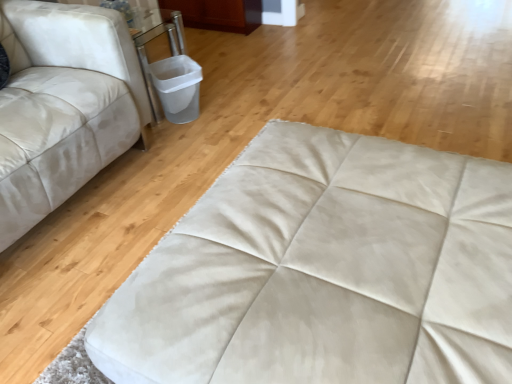
Question: Does white leather studio couch at left come in front of beige suede ottoman at center?

Choices:
 (A) yes
 (B) no

Answer: (B)

Question: Can you confirm if white leather studio couch at left is bigger than beige suede ottoman at center?

Choices:
 (A) no
 (B) yes

Answer: (B)

Question: Considering the relative sizes of white leather studio couch at left and beige suede ottoman at center in the image provided, is white leather studio couch at left taller than beige suede ottoman at center?

Choices:
 (A) no
 (B) yes

Answer: (B)

Question: Is white leather studio couch at left placed right next to beige suede ottoman at center?

Choices:
 (A) yes
 (B) no

Answer: (B)

Question: Would you say white leather studio couch at left contains beige suede ottoman at center?

Choices:
 (A) yes
 (B) no

Answer: (B)

Question: Considering the relative sizes of white leather studio couch at left and beige suede ottoman at center in the image provided, is white leather studio couch at left thinner than beige suede ottoman at center?

Choices:
 (A) no
 (B) yes

Answer: (B)

Question: Is beige suede ottoman at center taller than white leather studio couch at left?

Choices:
 (A) yes
 (B) no

Answer: (B)

Question: Considering the relative sizes of beige suede ottoman at center and white leather studio couch at left in the image provided, is beige suede ottoman at center smaller than white leather studio couch at left?

Choices:
 (A) no
 (B) yes

Answer: (B)

Question: Considering the relative positions of beige suede ottoman at center and white leather studio couch at left in the image provided, is beige suede ottoman at center behind white leather studio couch at left?

Choices:
 (A) yes
 (B) no

Answer: (B)

Question: From a real-world perspective, is beige suede ottoman at center under white leather studio couch at left?

Choices:
 (A) no
 (B) yes

Answer: (B)

Question: Is beige suede ottoman at center aimed at white leather studio couch at left?

Choices:
 (A) yes
 (B) no

Answer: (B)

Question: Is beige suede ottoman at center located outside white leather studio couch at left?

Choices:
 (A) yes
 (B) no

Answer: (A)

Question: Considering the positions of beige suede ottoman at center and white leather studio couch at left in the image, is beige suede ottoman at center bigger or smaller than white leather studio couch at left?

Choices:
 (A) small
 (B) big

Answer: (A)